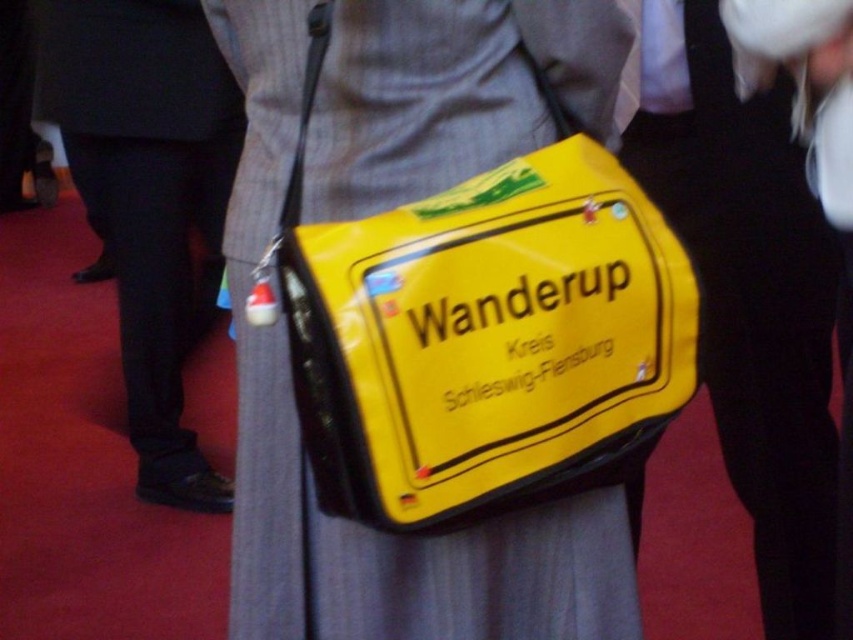
You are an event organizer checking the attire of participants. You notice the yellow matte bag at center and the black leather pants at left. Which item is located lower on the person?

The yellow matte bag at center is positioned under the black leather pants at left, so the yellow matte bag at center is located lower.

You are a photographer setting up for a photoshoot. You have a yellow matte bag at center and black leather pants at left in your frame. Which item is closer to the camera?

The yellow matte bag at center is closer to the camera because it is in front of the black leather pants at left.